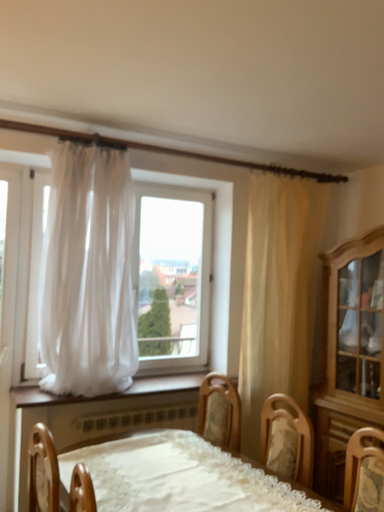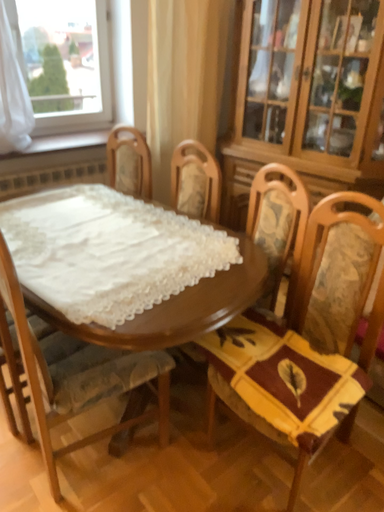
Question: How did the camera likely rotate when shooting the video?

Choices:
 (A) rotated left
 (B) rotated right

Answer: (B)